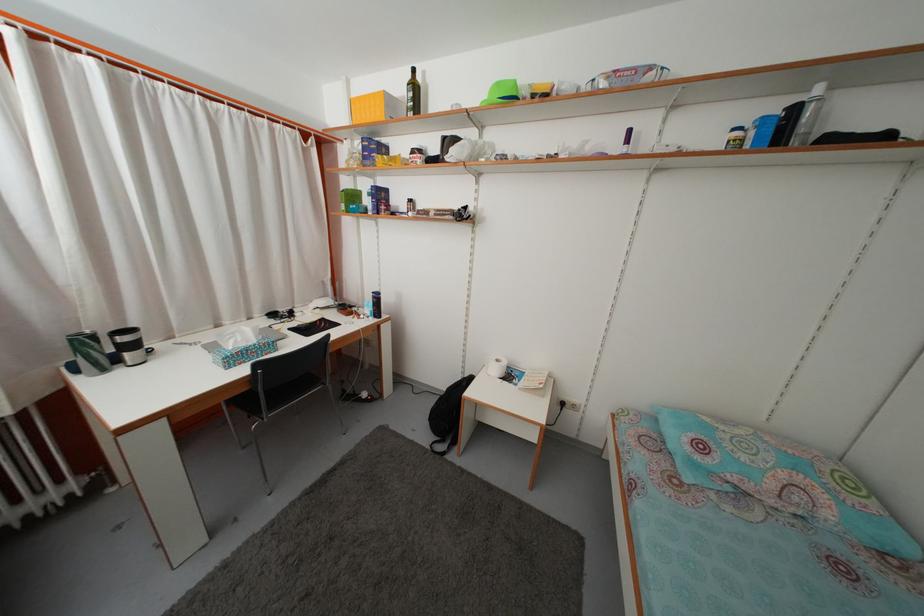
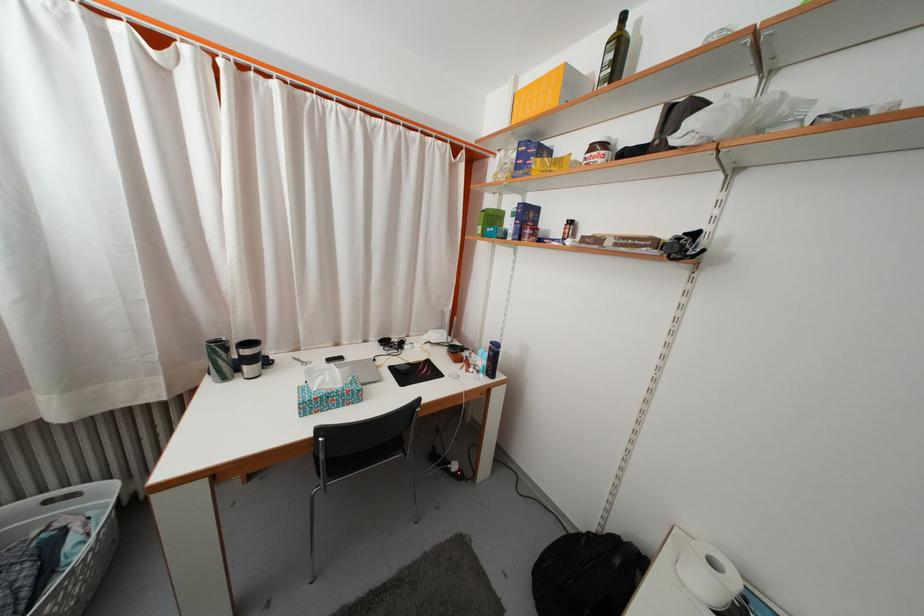
Locate, in the second image, the point that corresponds to point (420, 95) in the first image.

(625, 54)